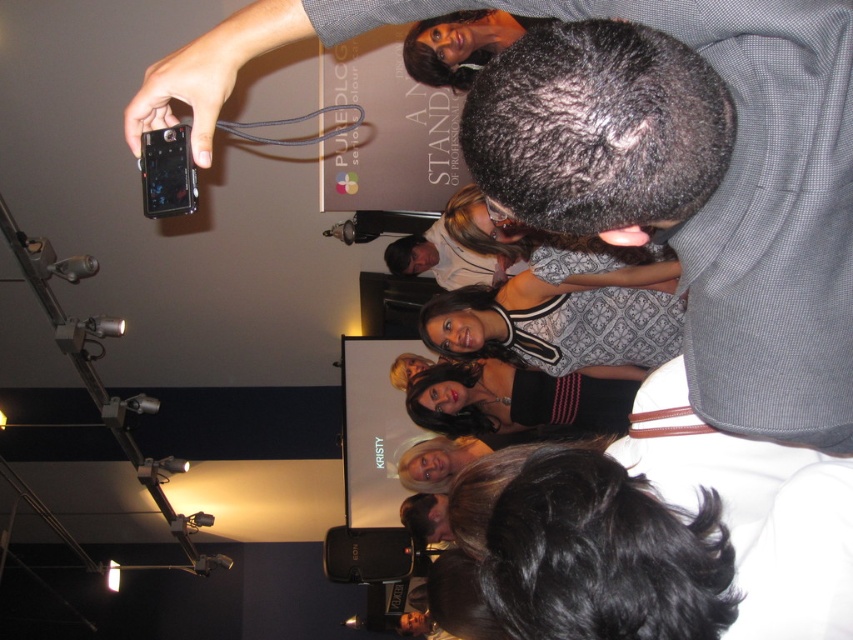
You are a photographer at the event and need to ensure your equipment fits in a case. The case has a width limit of 10 cm. You have the gray textured shirt at upper right and the matte black smartphone at upper left. Which item is wider and might exceed the case width limit?

The gray textured shirt at upper right might be wider than matte black smartphone at upper left, so it could exceed the case width limit of 10 cm.

You are standing in the rotated image and want to move towards the closest point between point (851, 35) and point (148, 186). Which point should you head towards?

Point (851, 35) is closer to the viewer than point (148, 186), so you should head towards point (851, 35).